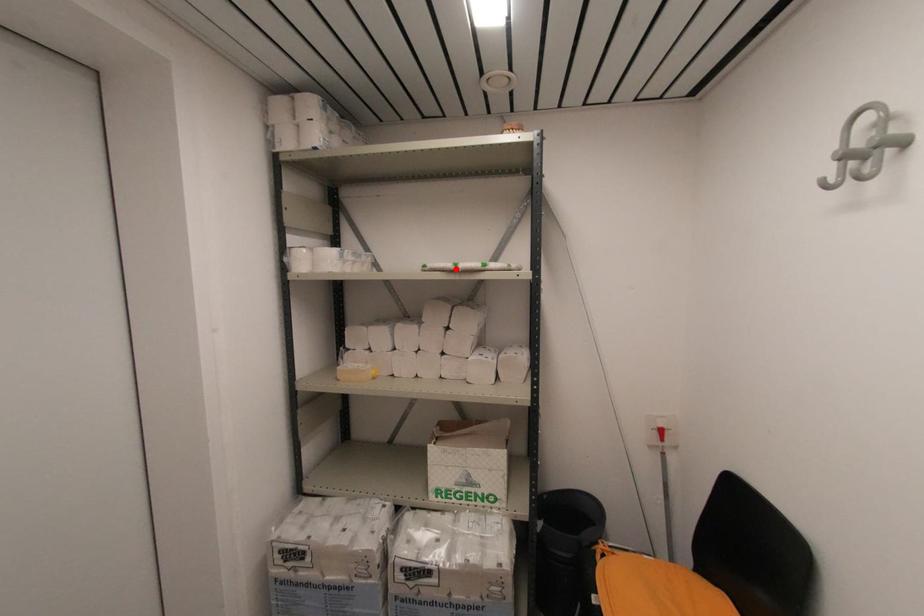
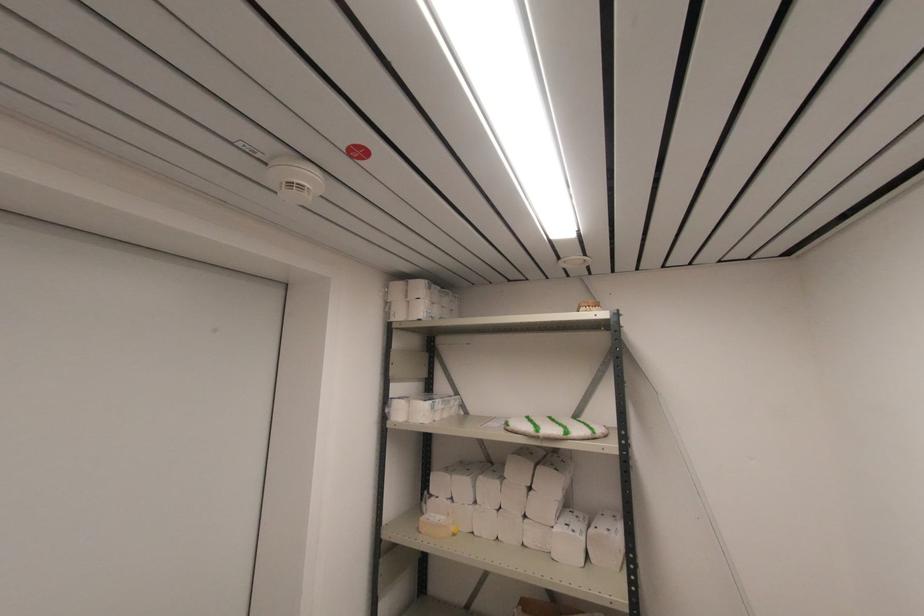
Where in the second image is the point corresponding to the highlighted location from the first image?

(537, 436)